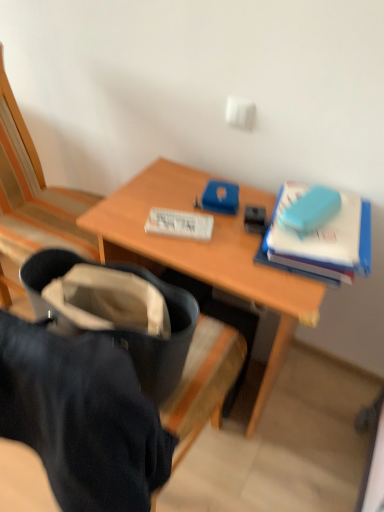
I want to click on free point to the left of white paper at center, placed as the first paperback book when sorted from left to right, so click(x=130, y=213).